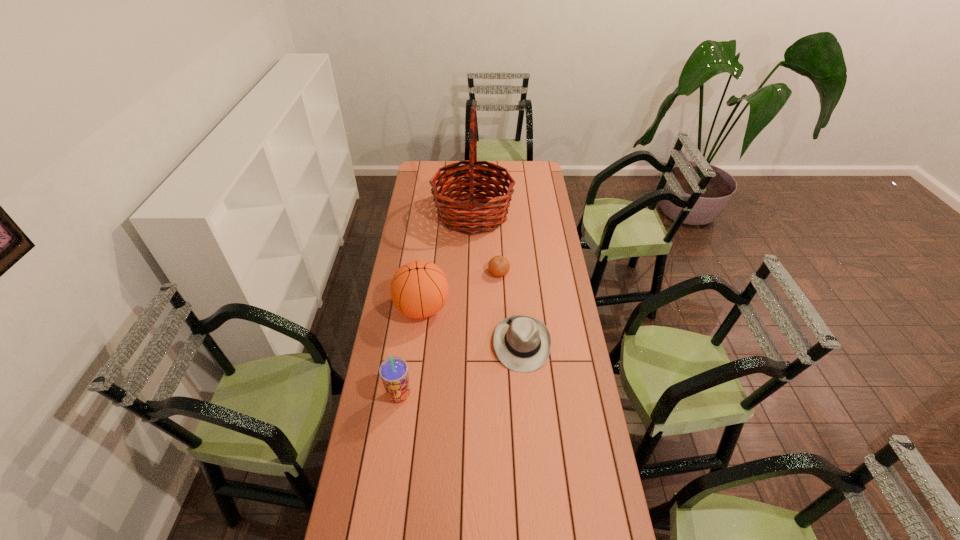
The width and height of the screenshot is (960, 540). I want to click on basket, so click(x=468, y=217).

Find the location of a particular element. Image resolution: width=960 pixels, height=540 pixels. the tallest object is located at coordinates (468, 217).

Locate an element on the screen. Image resolution: width=960 pixels, height=540 pixels. the nearest object is located at coordinates (393, 371).

Find the location of `basketball`. basketball is located at coordinates (419, 289).

Find the location of a particular element. fedora is located at coordinates (522, 343).

The width and height of the screenshot is (960, 540). What are the coordinates of `the fourth nearest object` in the screenshot? It's located at (498, 266).

Locate an element on the screen. clementine is located at coordinates (498, 266).

Identify the location of free space located 0.050m on the handle side of the tallest object. The width and height of the screenshot is (960, 540). (523, 214).

I want to click on vacant point located 0.160m on the right of the nearest object, so click(x=457, y=395).

Where is `vacant space situated on the back of the basketball`? vacant space situated on the back of the basketball is located at coordinates (427, 271).